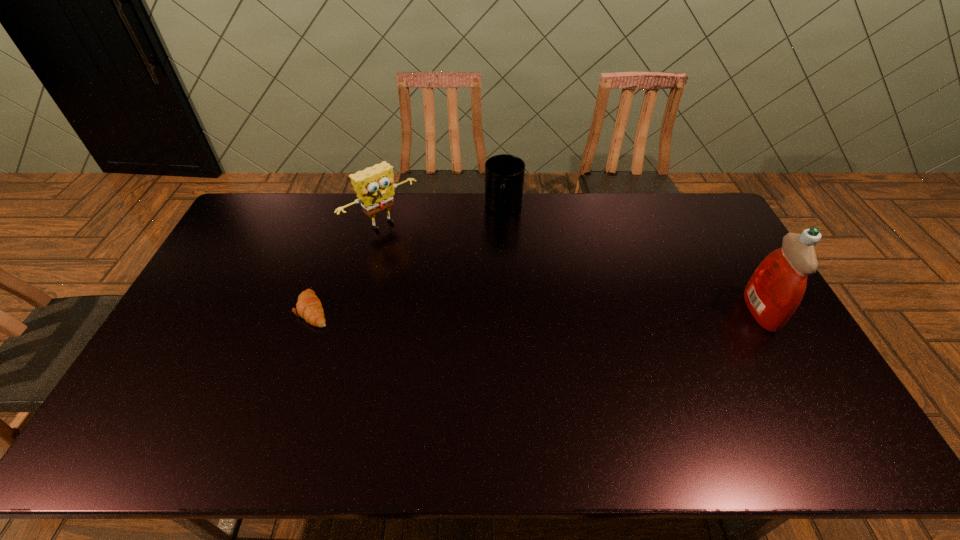
The image size is (960, 540). Find the location of `vacant space located 0.370m on the face of the sponge`. vacant space located 0.370m on the face of the sponge is located at coordinates (468, 300).

Identify the location of vacant space located 0.350m on the face of the sponge. [464, 296].

The width and height of the screenshot is (960, 540). In order to click on free spot located on the face of the sponge in this screenshot , I will do `click(421, 258)`.

This screenshot has height=540, width=960. What are the coordinates of `mug positioned at the far edge` in the screenshot? It's located at [x=504, y=174].

Find the location of `sponge located at the far edge`. sponge located at the far edge is located at coordinates (374, 186).

Locate an element on the screen. This screenshot has height=540, width=960. object that is at the right edge is located at coordinates (776, 288).

Identify the location of vacant space at the far edge. The width and height of the screenshot is (960, 540). (537, 218).

At what (x,y) coordinates should I click in order to perform the action: click on free spot at the near edge of the desktop. Please return your answer as a coordinate pair (x, y). Looking at the image, I should click on (342, 404).

Image resolution: width=960 pixels, height=540 pixels. In the image, there is a desktop. In order to click on blank space at the left edge in this screenshot , I will do `click(205, 280)`.

The image size is (960, 540). In order to click on free point at the right edge in this screenshot , I will do `click(716, 305)`.